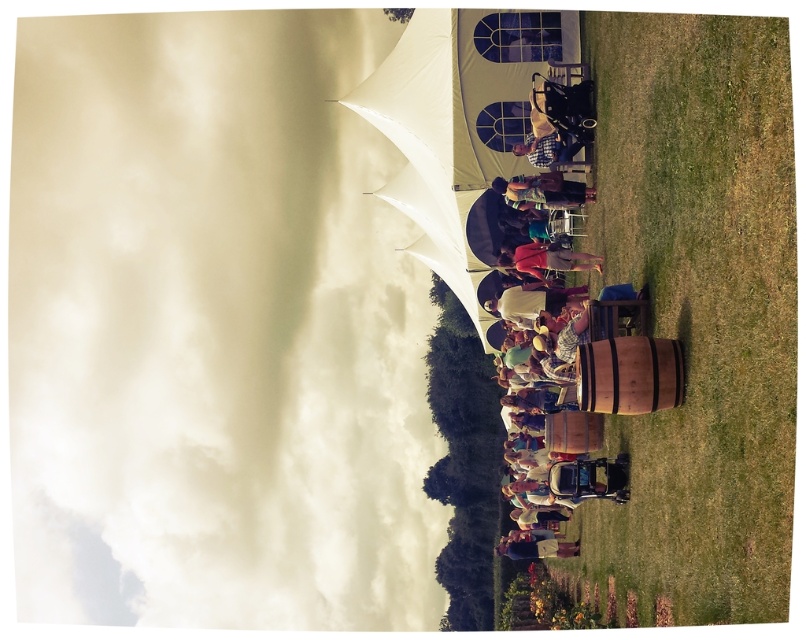
You are at the outdoor gathering and need to choose a jacket to wear. Which jacket, the matte brown jacket at center or the denim jacket at lower center, is more suitable if you want a smaller size?

The matte brown jacket at center has a smaller size compared to the denim jacket at lower center, so it is more suitable if you want a smaller size.

You are at the entrance of the tent and want to take a photo of the white fluffy cloud at upper left. Since the tent is white, you need to ensure you are not standing in front of it. Where should you position yourself to avoid blocking the cloud?

The white fluffy cloud at upper left is located at point (214, 330), so you should position yourself to the right or below that coordinate to avoid blocking it.

You are at the outdoor gathering under the tent and notice the white fluffy cloud at upper left and the matte red shirt at center. Which object is located lower in the image?

The white fluffy cloud at upper left is positioned under the matte red shirt at center, so it is located lower in the image.